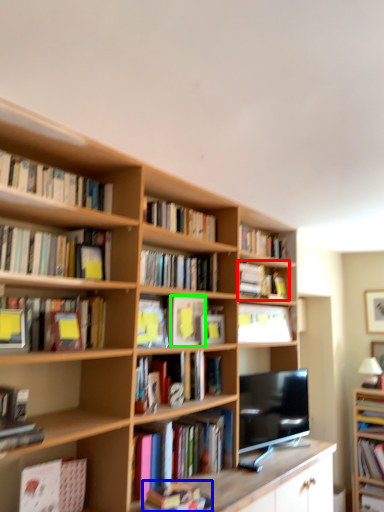
Question: Which object is the farthest from book (highlighted by a red box)? Choose among these: book (highlighted by a blue box) or paperback book (highlighted by a green box).

Choices:
 (A) book
 (B) paperback book

Answer: (A)